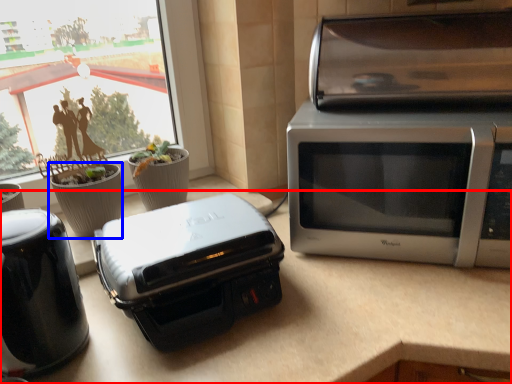
Question: Which object is closer to the camera taking this photo, counter top (highlighted by a red box) or flowerpot (highlighted by a blue box)?

Choices:
 (A) counter top
 (B) flowerpot

Answer: (A)